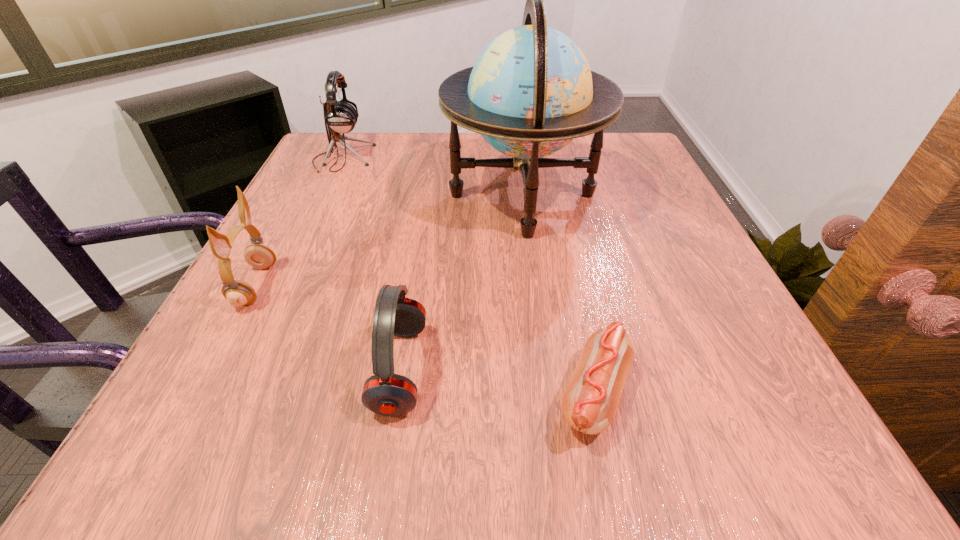
Locate an element on the screen. The image size is (960, 540). free space that is in between the sausage and the farthest earphone is located at coordinates (468, 276).

At what (x,y) coordinates should I click in order to perform the action: click on empty space that is in between the shortest object and the third nearest object. Please return your answer as a coordinate pair (x, y). The height and width of the screenshot is (540, 960). Looking at the image, I should click on (425, 340).

In order to click on free space that is in between the second farthest earphone and the globe in this screenshot , I will do `click(389, 240)`.

What are the coordinates of `vacant space in between the shortest object and the tallest earphone` in the screenshot? It's located at (468, 276).

Where is `empty space that is in between the farthest earphone and the nearest earphone`? This screenshot has width=960, height=540. empty space that is in between the farthest earphone and the nearest earphone is located at coordinates tap(372, 264).

At what (x,y) coordinates should I click in order to perform the action: click on vacant area that lies between the second nearest earphone and the sausage. Please return your answer as a coordinate pair (x, y). The width and height of the screenshot is (960, 540). Looking at the image, I should click on (425, 340).

Where is `vacant space that's between the second tallest object and the rightmost earphone`? This screenshot has width=960, height=540. vacant space that's between the second tallest object and the rightmost earphone is located at coordinates (372, 264).

The image size is (960, 540). Identify the location of vacant space that is in between the sausage and the second nearest earphone. (425, 340).

Locate an element on the screen. This screenshot has width=960, height=540. vacant point located between the third object from left to right and the tallest earphone is located at coordinates (372, 264).

Select which object is the fourth closest to the tallest earphone. Please provide its 2D coordinates. Your answer should be formatted as a tuple, i.e. [(x, y)], where the tuple contains the x and y coordinates of a point satisfying the conditions above.

[(589, 404)]